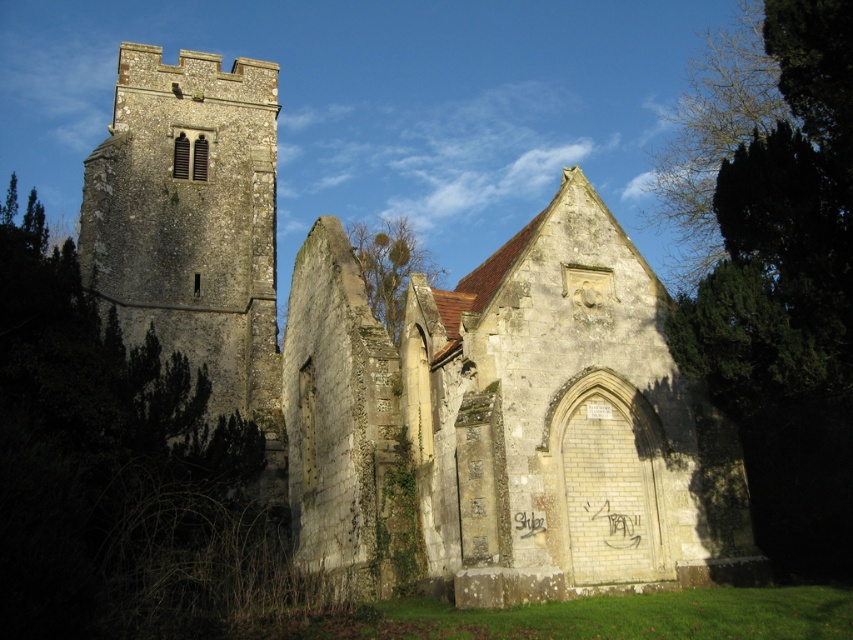
You are standing in front of the old stone structure and want to take a photo. You notice two points marked on the building. The first point is at coordinates point (628,387) and the second is at point (360,259). Which point will appear larger in your photo?

Point (628,387) is closer to the camera than point (360,259), so it will appear larger in the photo.

You are standing in front of the old stone structure and looking at the two green leafy trees. Which tree is nearer to you, the green leafy tree at right or the green leafy tree at center?

The green leafy tree at right is closer to the viewer than the green leafy tree at center, so the green leafy tree at right is nearer to you.

You are standing in front of the old stone structure and looking at two points marked on the image. One is at coordinate point (722,563) and the other at point (843,112). Which point is closer to you?

Point (722,563) is further to the camera than point (843,112), so the point closer to you is point (843,112).